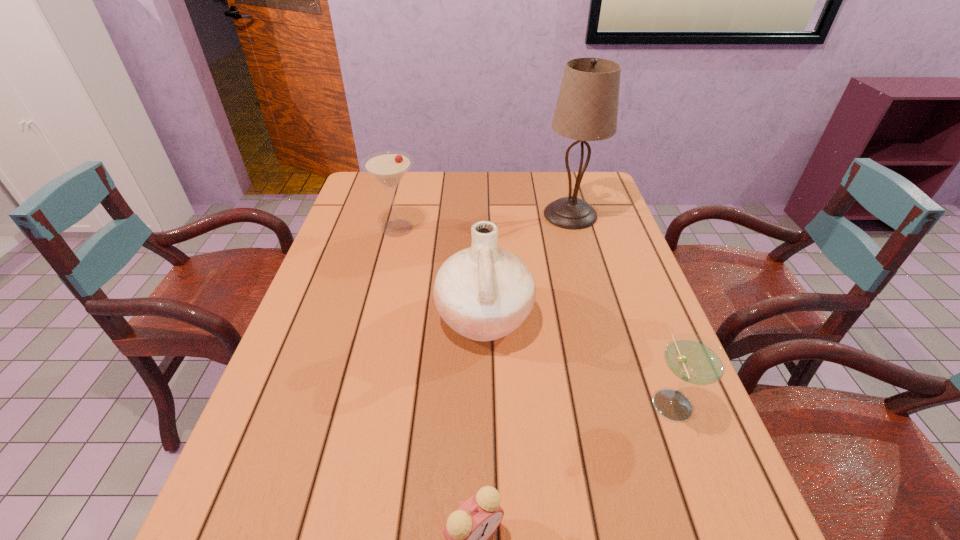
This screenshot has height=540, width=960. In order to click on vacant space at the near edge of the desktop in this screenshot , I will do `click(506, 535)`.

Where is `vacant space at the right edge of the desktop`? The width and height of the screenshot is (960, 540). vacant space at the right edge of the desktop is located at coordinates (660, 435).

Where is `vacant region at the far left corner of the desktop`? This screenshot has height=540, width=960. vacant region at the far left corner of the desktop is located at coordinates (380, 205).

The image size is (960, 540). Find the location of `vacant space at the far right corner of the desktop`. vacant space at the far right corner of the desktop is located at coordinates (564, 185).

Find the location of a particular element. Image resolution: width=960 pixels, height=540 pixels. empty space that is in between the left martini and the fourth farthest object is located at coordinates (535, 315).

I want to click on vacant space that's between the right martini and the pottery, so click(x=578, y=360).

Image resolution: width=960 pixels, height=540 pixels. Find the location of `free space between the shorter martini and the tallest object`. free space between the shorter martini and the tallest object is located at coordinates (621, 308).

Where is `vacant space that's between the lampshade and the fourth farthest object`? This screenshot has width=960, height=540. vacant space that's between the lampshade and the fourth farthest object is located at coordinates [x=621, y=308].

Find the location of a particular element. Image resolution: width=960 pixels, height=540 pixels. object that is the closest to the tallest object is located at coordinates (484, 292).

Locate which object is the second closest to the second nearest object. Please provide its 2D coordinates. Your answer should be formatted as a tuple, i.e. [(x, y)], where the tuple contains the x and y coordinates of a point satisfying the conditions above.

[(467, 530)]